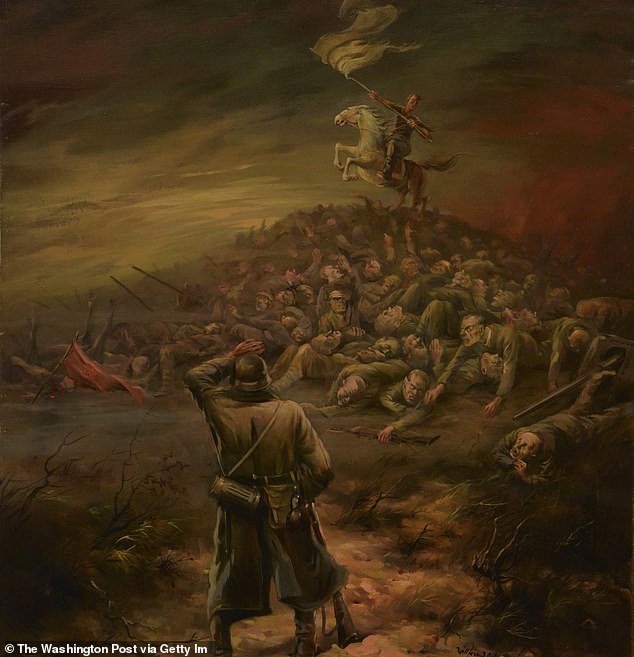
What are the coordinates of `canteen` in the screenshot? It's located at point(226,491).